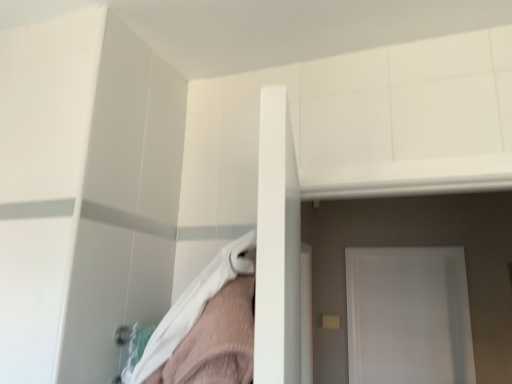
The height and width of the screenshot is (384, 512). Describe the element at coordinates (193, 305) in the screenshot. I see `white soft fabric at center` at that location.

Find the location of a particular element. white soft fabric at center is located at coordinates tap(193, 305).

Where is `white soft fabric at center`? This screenshot has width=512, height=384. white soft fabric at center is located at coordinates (193, 305).